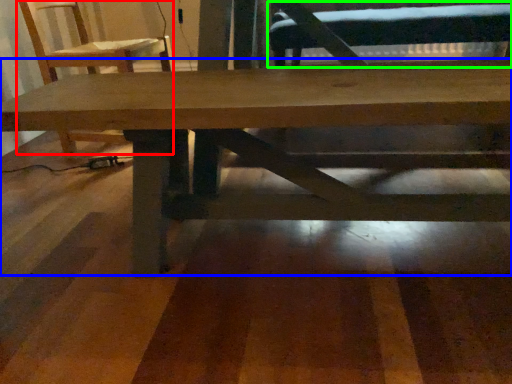
Question: Based on their relative distances, which object is farther from chair (highlighted by a red box)? Choose from table (highlighted by a blue box) and swivel chair (highlighted by a green box).

Choices:
 (A) table
 (B) swivel chair

Answer: (B)